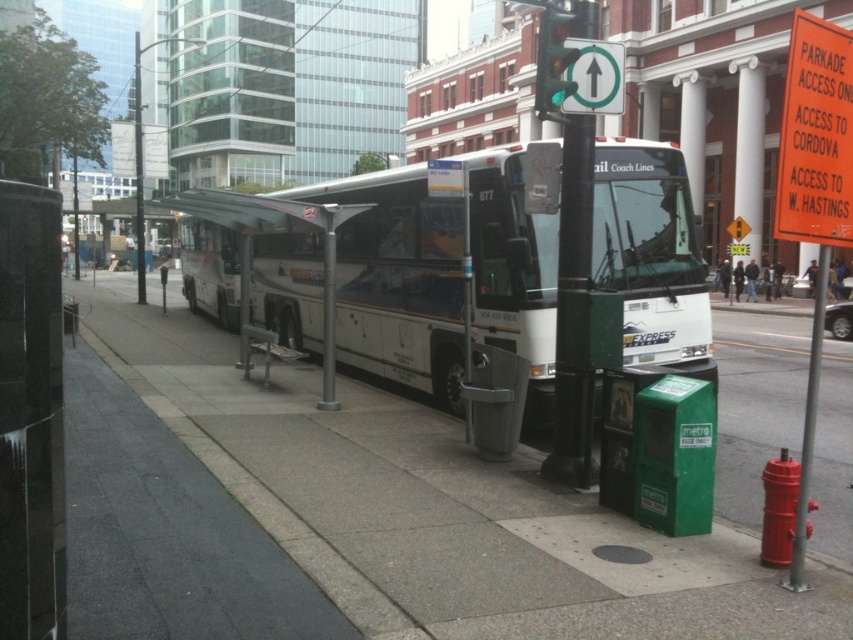
Question: Where is gray concrete pavement at center located in relation to green plastic sign at upper center in the image?

Choices:
 (A) above
 (B) below

Answer: (B)

Question: Among these objects, which one is nearest to the camera?

Choices:
 (A) white glossy bus at center
 (B) green plastic sign at upper center
 (C) metallic pole at lower right

Answer: (C)

Question: Which point appears closest to the camera in this image?

Choices:
 (A) (561, 108)
 (B) (804, 445)
 (C) (531, 392)

Answer: (B)

Question: Based on their relative distances, which object is nearer to the metallic green traffic light at upper center?

Choices:
 (A) white glossy bus at center
 (B) green plastic sign at upper center

Answer: (B)

Question: Does white glossy bus at center have a larger size compared to green plastic sign at upper center?

Choices:
 (A) no
 (B) yes

Answer: (B)

Question: Can you confirm if white glossy bus at center is smaller than green plastic sign at upper center?

Choices:
 (A) yes
 (B) no

Answer: (B)